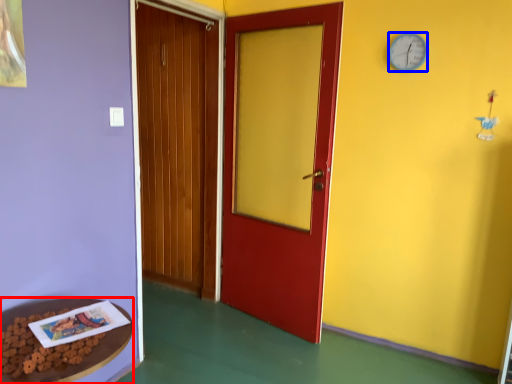
Question: Which of the following is the closest to the observer, table (highlighted by a red box) or clock (highlighted by a blue box)?

Choices:
 (A) table
 (B) clock

Answer: (A)